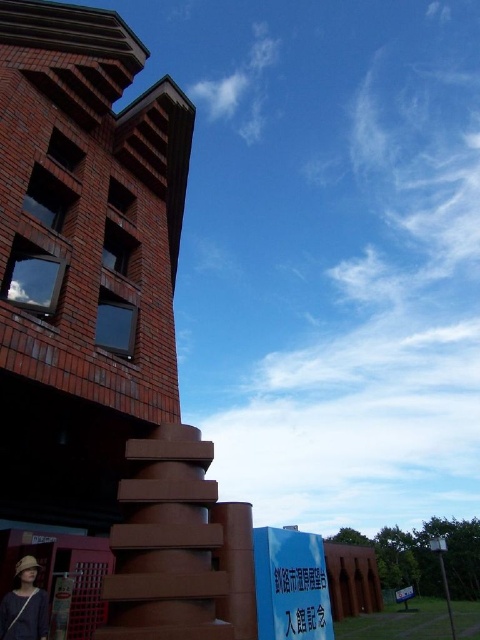
Question: Which of these objects is positioned farthest from the blue glossy sign at lower center?

Choices:
 (A) matte brown hat at lower left
 (B) white plastic sign at lower right

Answer: (B)

Question: Which point is farther to the camera?

Choices:
 (A) (36, 604)
 (B) (288, 540)

Answer: (B)

Question: Is blue glossy sign at lower center thinner than matte brown hat at lower left?

Choices:
 (A) yes
 (B) no

Answer: (A)

Question: Does blue glossy sign at lower center appear over matte brown hat at lower left?

Choices:
 (A) yes
 (B) no

Answer: (B)

Question: Is blue glossy sign at lower center to the right of matte brown hat at lower left from the viewer's perspective?

Choices:
 (A) no
 (B) yes

Answer: (B)

Question: Which object appears closest to the camera in this image?

Choices:
 (A) white plastic sign at lower right
 (B) blue glossy sign at lower center
 (C) matte brown hat at lower left

Answer: (C)